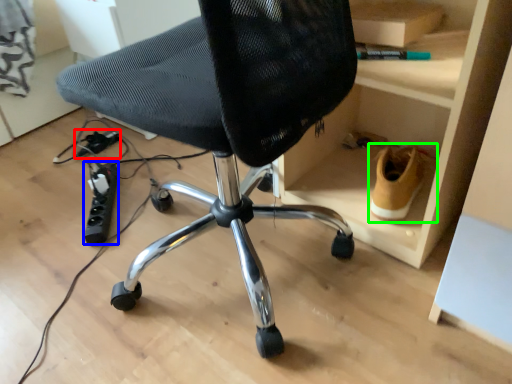
Question: Which object is positioned closest to plug (highlighted by a red box)? Select from plug (highlighted by a blue box) and footwear (highlighted by a green box).

Choices:
 (A) plug
 (B) footwear

Answer: (A)